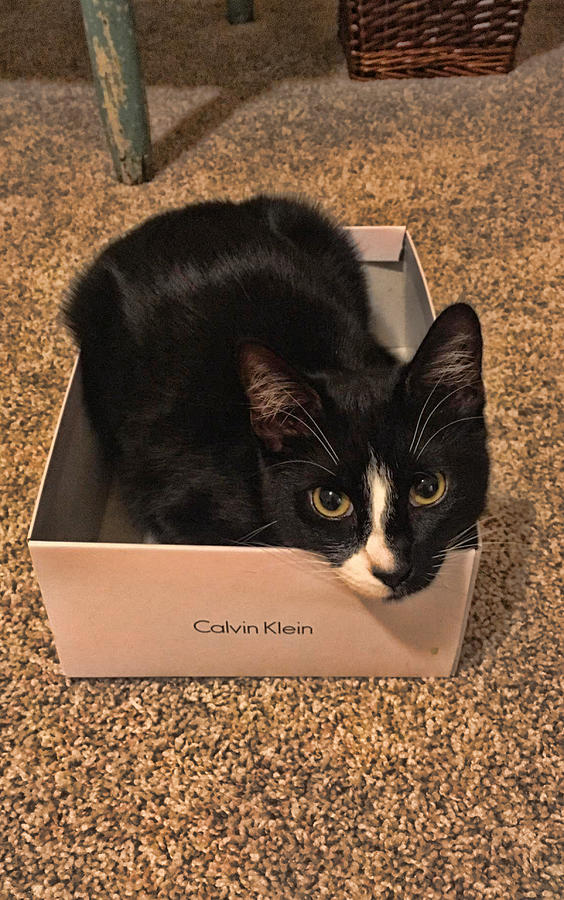
The width and height of the screenshot is (564, 900). Find the location of `wicker basket`. wicker basket is located at coordinates (403, 34).